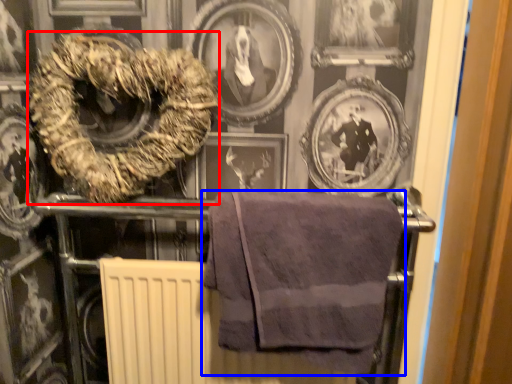
Question: Which of the following is the farthest to the observer, towel (highlighted by a red box) or towel (highlighted by a blue box)?

Choices:
 (A) towel
 (B) towel

Answer: (A)